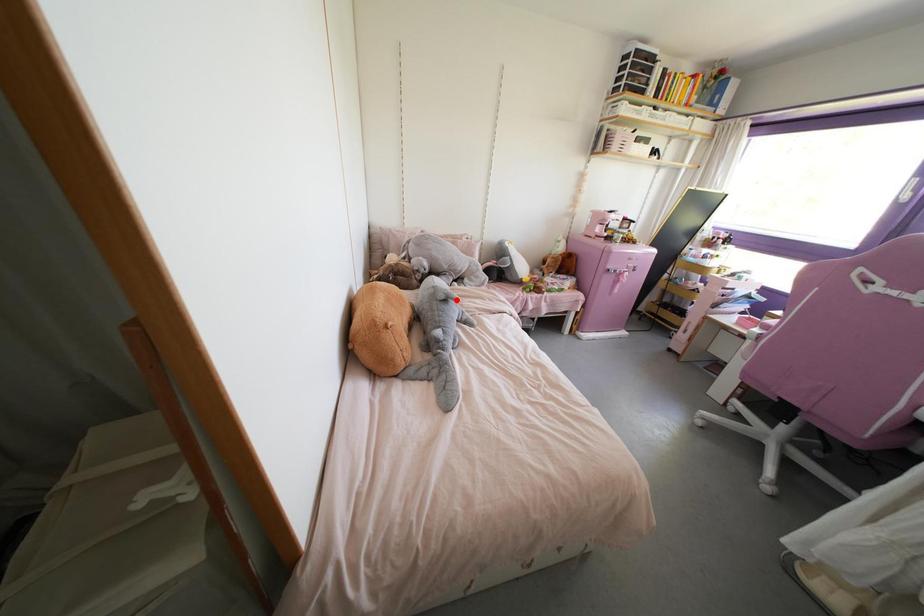
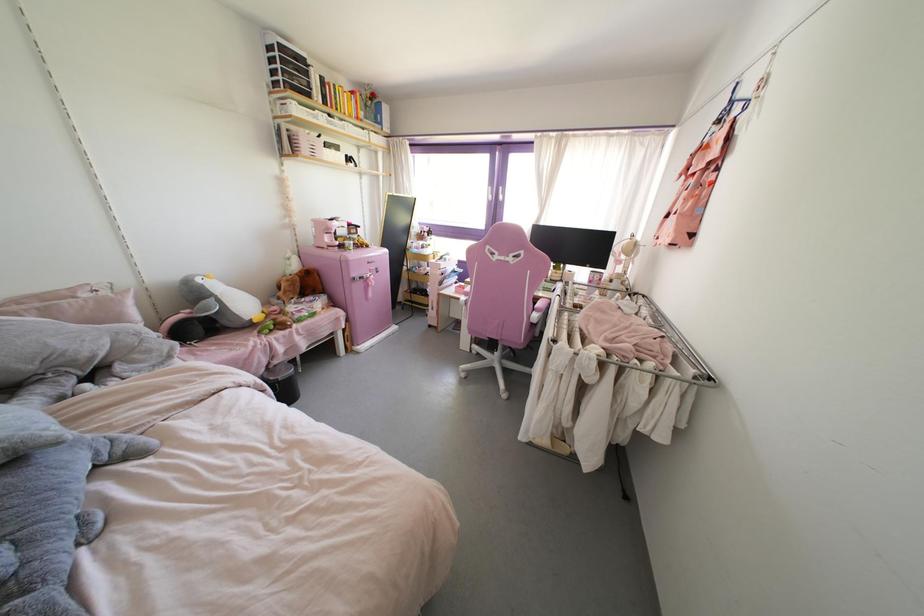
Question: I am providing you with two images of the same scene from different viewpoints. In image1, a red point is highlighted. Considering the same 3D point in image2, which of the following is correct?

Choices:
 (A) It is closer
 (B) It is farther

Answer: (A)